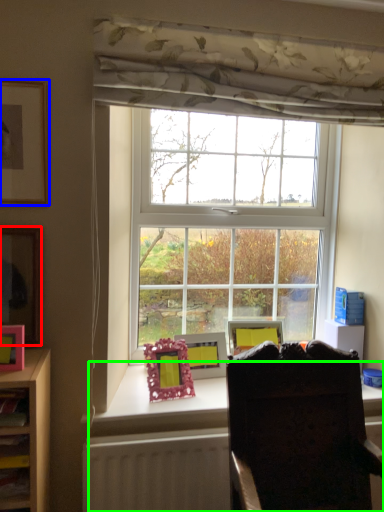
Question: Estimate the real-world distances between objects in this image. Which object is closer to picture frame (highlighted by a red box), picture frame (highlighted by a blue box) or desk (highlighted by a green box)?

Choices:
 (A) picture frame
 (B) desk

Answer: (A)